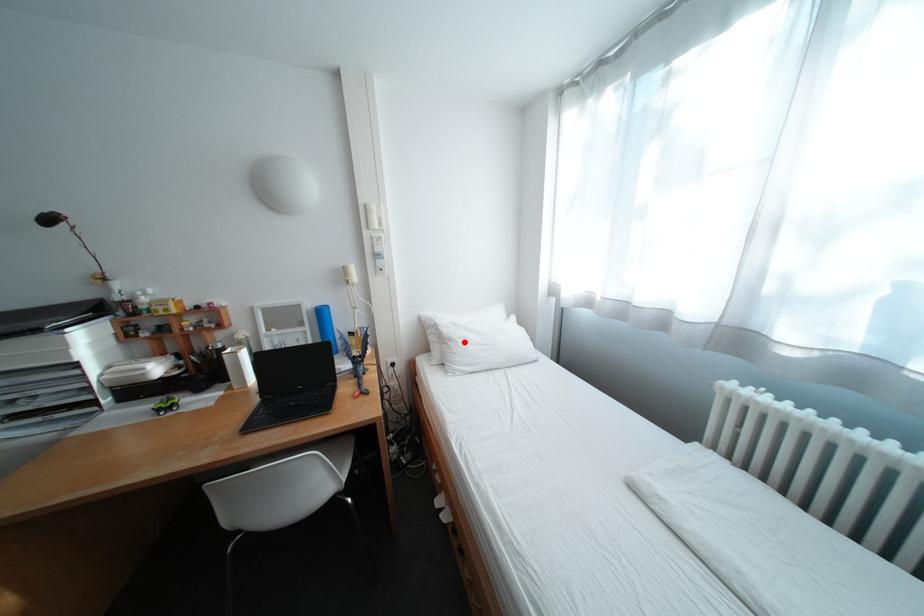
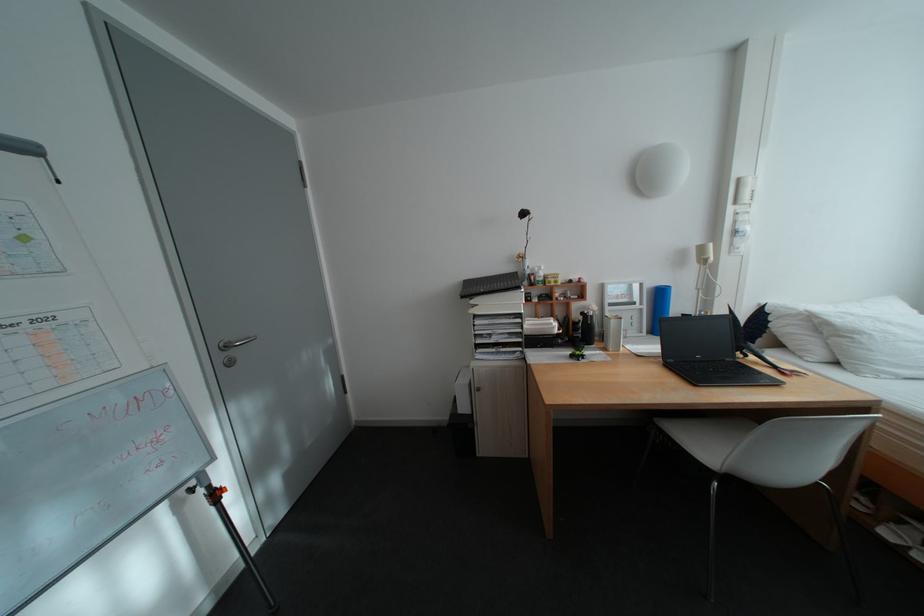
In the second image, find the point that corresponds to the highlighted location in the first image.

(871, 334)